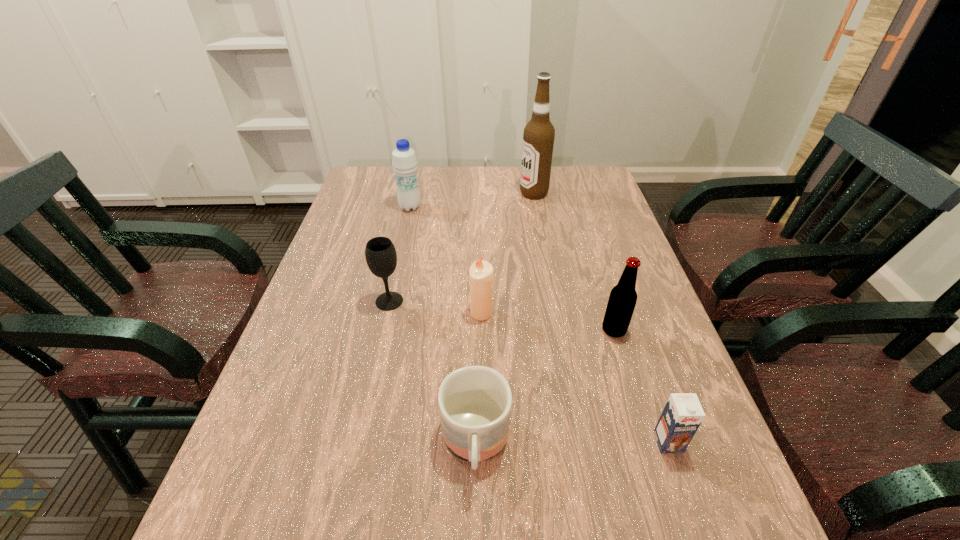
Locate an element on the screen. This screenshot has height=540, width=960. chocolate milk situated at the right edge is located at coordinates (x=682, y=415).

Identify the location of vacant space at the far edge. This screenshot has height=540, width=960. (459, 188).

At what (x,y) coordinates should I click in order to perform the action: click on free space at the left edge of the desktop. Please return your answer as a coordinate pair (x, y). The image size is (960, 540). Looking at the image, I should click on (324, 346).

Where is `free location at the right edge`? free location at the right edge is located at coordinates point(603,241).

Where is `vacant space at the far left corner of the desktop`? This screenshot has height=540, width=960. vacant space at the far left corner of the desktop is located at coordinates (363, 168).

This screenshot has height=540, width=960. I want to click on vacant space at the far right corner, so click(572, 199).

Locate an element on the screen. This screenshot has height=540, width=960. empty space between the beer bottle and the chocolate milk is located at coordinates (641, 386).

Where is `free space between the beer bottle and the chocolate milk`? free space between the beer bottle and the chocolate milk is located at coordinates (641, 386).

Locate an element on the screen. The height and width of the screenshot is (540, 960). vacant area that lies between the wineglass and the alcohol is located at coordinates (462, 247).

Where is `free space between the wineglass and the water bottle`? This screenshot has width=960, height=540. free space between the wineglass and the water bottle is located at coordinates (399, 254).